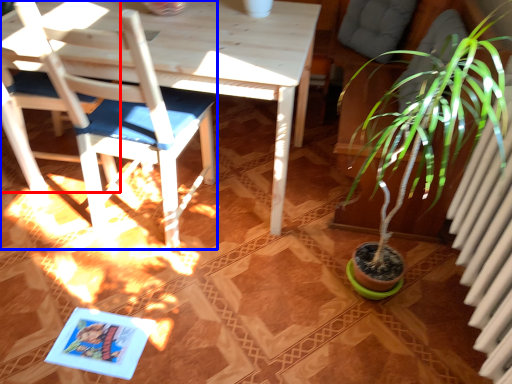
Question: Among these objects, which one is nearest to the camera, chair (highlighted by a red box) or chair (highlighted by a blue box)?

Choices:
 (A) chair
 (B) chair

Answer: (B)